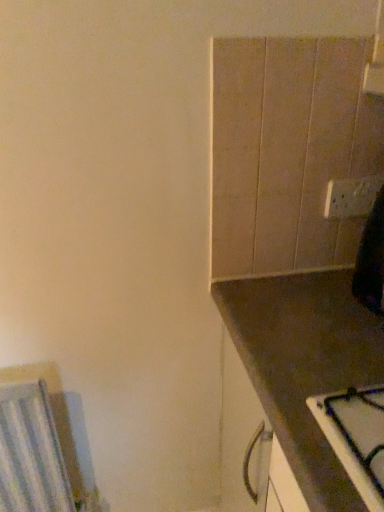
Question: Is brown matte countertop at right inside white glossy electric outlet at upper right?

Choices:
 (A) no
 (B) yes

Answer: (A)

Question: Is white glossy electric outlet at upper right thinner than brown matte countertop at right?

Choices:
 (A) yes
 (B) no

Answer: (A)

Question: Is white glossy electric outlet at upper right positioned beyond the bounds of brown matte countertop at right?

Choices:
 (A) yes
 (B) no

Answer: (A)

Question: Is the depth of white glossy electric outlet at upper right greater than that of brown matte countertop at right?

Choices:
 (A) yes
 (B) no

Answer: (A)

Question: Does white glossy electric outlet at upper right have a greater height compared to brown matte countertop at right?

Choices:
 (A) yes
 (B) no

Answer: (B)

Question: Is white glossy electric outlet at upper right to the right of brown matte countertop at right from the viewer's perspective?

Choices:
 (A) no
 (B) yes

Answer: (B)

Question: Does brown matte countertop at right have a lesser height compared to white glossy electric outlet at upper right?

Choices:
 (A) no
 (B) yes

Answer: (A)

Question: Is brown matte countertop at right far away from white glossy electric outlet at upper right?

Choices:
 (A) yes
 (B) no

Answer: (B)

Question: From a real-world perspective, is brown matte countertop at right located higher than white glossy electric outlet at upper right?

Choices:
 (A) no
 (B) yes

Answer: (A)

Question: Is brown matte countertop at right further to the viewer compared to white glossy electric outlet at upper right?

Choices:
 (A) no
 (B) yes

Answer: (A)

Question: Can you confirm if brown matte countertop at right is thinner than white glossy electric outlet at upper right?

Choices:
 (A) no
 (B) yes

Answer: (A)

Question: Is brown matte countertop at right bigger than white glossy electric outlet at upper right?

Choices:
 (A) no
 (B) yes

Answer: (B)

Question: From a real-world perspective, relative to brown matte countertop at right, is white glossy electric outlet at upper right vertically above or below?

Choices:
 (A) above
 (B) below

Answer: (A)